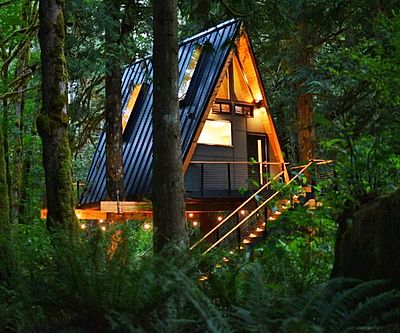
Where is `underneath stair case`? underneath stair case is located at coordinates (255, 255).